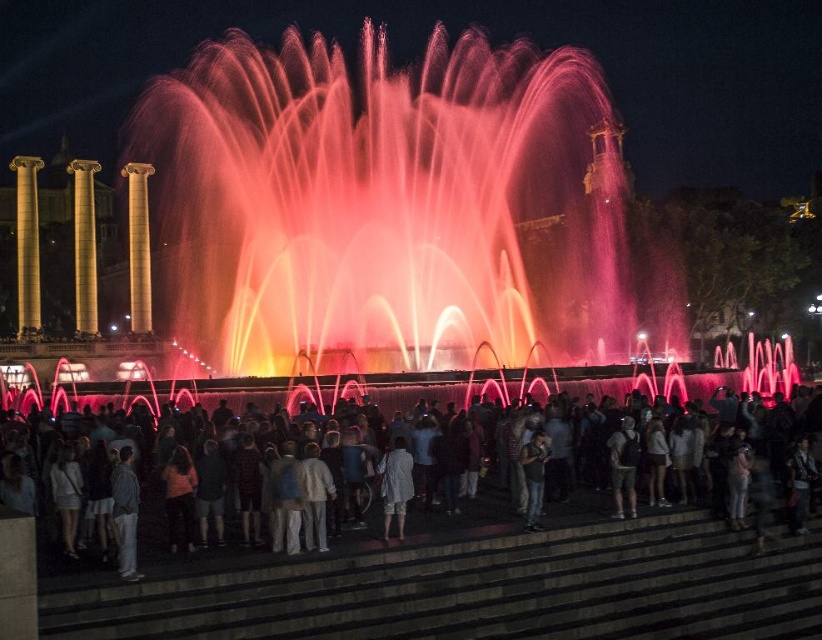
Question: Can you confirm if gold polished column at center is thinner than light gray cotton shirt at lower left?

Choices:
 (A) yes
 (B) no

Answer: (B)

Question: Which point is closer to the camera?

Choices:
 (A) denim jeans at center
 (B) shimmering pink water at center
 (C) gold polished column at left
 (D) white cotton shirt at center

Answer: (D)

Question: Is gold polished column at left wider than light gray cotton shirt at lower left?

Choices:
 (A) no
 (B) yes

Answer: (B)

Question: Which of the following is the closest to the observer?

Choices:
 (A) gold polished column at left
 (B) light gray cotton shirt at lower left

Answer: (B)

Question: Which object is farther from the camera taking this photo?

Choices:
 (A) matte white crowd at lower center
 (B) gold polished column at left

Answer: (B)

Question: Is gold polished column at left smaller than light gray cotton shirt at lower left?

Choices:
 (A) no
 (B) yes

Answer: (A)